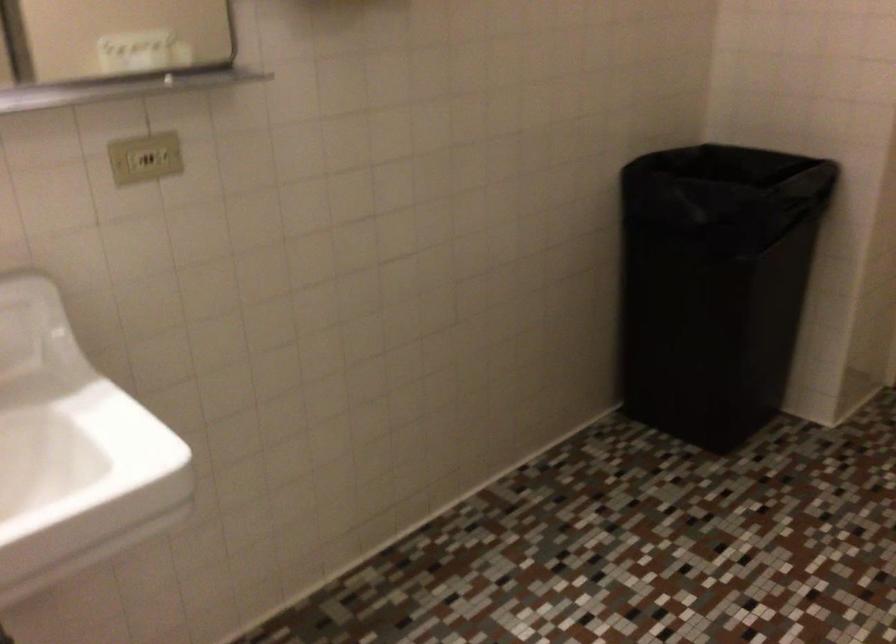
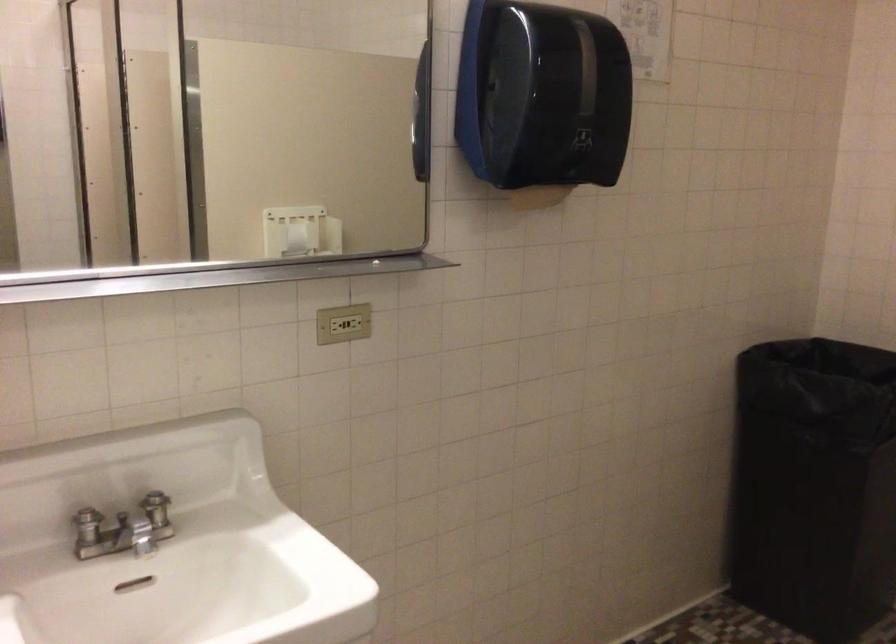
In the second image, find the point that corresponds to the point at 693,301 in the first image.

(814, 486)